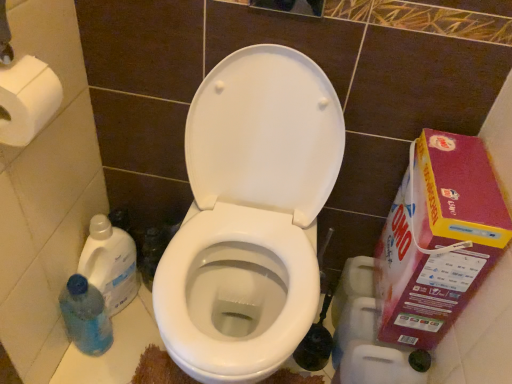
Question: From a real-world perspective, is pink cardboard box at right beneath blue translucent bottle at lower left, which is the 1th cleaning product in bottom-to-top order?

Choices:
 (A) yes
 (B) no

Answer: (B)

Question: From the image's perspective, is pink cardboard box at right below blue translucent bottle at lower left, which ranks as the 2th cleaning product in top-to-bottom order?

Choices:
 (A) no
 (B) yes

Answer: (A)

Question: Does pink cardboard box at right have a lesser height compared to blue translucent bottle at lower left, which is the 1th cleaning product in bottom-to-top order?

Choices:
 (A) yes
 (B) no

Answer: (B)

Question: Is pink cardboard box at right taller than blue translucent bottle at lower left, which is the 1th cleaning product in bottom-to-top order?

Choices:
 (A) yes
 (B) no

Answer: (A)

Question: From a real-world perspective, is pink cardboard box at right physically above blue translucent bottle at lower left, which ranks as the 2th cleaning product in top-to-bottom order?

Choices:
 (A) yes
 (B) no

Answer: (A)

Question: Is white glossy toilet at center situated inside pink cardboard box at right or outside?

Choices:
 (A) inside
 (B) outside

Answer: (B)

Question: Would you say white glossy toilet at center is to the left or to the right of pink cardboard box at right in the picture?

Choices:
 (A) left
 (B) right

Answer: (A)

Question: In the image, is white glossy toilet at center positioned in front of or behind pink cardboard box at right?

Choices:
 (A) behind
 (B) front

Answer: (B)

Question: In terms of size, does white glossy toilet at center appear bigger or smaller than pink cardboard box at right?

Choices:
 (A) small
 (B) big

Answer: (B)

Question: Considering the positions of blue translucent bottle at lower left, which ranks as the second cleaning product in bottom-to-top order, and white matte toilet paper at upper left in the image, is blue translucent bottle at lower left, which ranks as the second cleaning product in bottom-to-top order, taller or shorter than white matte toilet paper at upper left?

Choices:
 (A) short
 (B) tall

Answer: (B)

Question: Would you say blue translucent bottle at lower left, which ranks as the second cleaning product in bottom-to-top order, is to the left or to the right of white matte toilet paper at upper left in the picture?

Choices:
 (A) right
 (B) left

Answer: (B)

Question: From a real-world perspective, is blue translucent bottle at lower left, positioned as the 1th cleaning product in top-to-bottom order, above or below white matte toilet paper at upper left?

Choices:
 (A) above
 (B) below

Answer: (B)

Question: In terms of size, does blue translucent bottle at lower left, positioned as the 1th cleaning product in top-to-bottom order, appear bigger or smaller than white matte toilet paper at upper left?

Choices:
 (A) small
 (B) big

Answer: (B)

Question: Considering the positions of white matte toilet paper at upper left and pink cardboard box at right in the image, is white matte toilet paper at upper left wider or thinner than pink cardboard box at right?

Choices:
 (A) thin
 (B) wide

Answer: (A)

Question: Considering their positions, is white matte toilet paper at upper left located in front of or behind pink cardboard box at right?

Choices:
 (A) front
 (B) behind

Answer: (A)